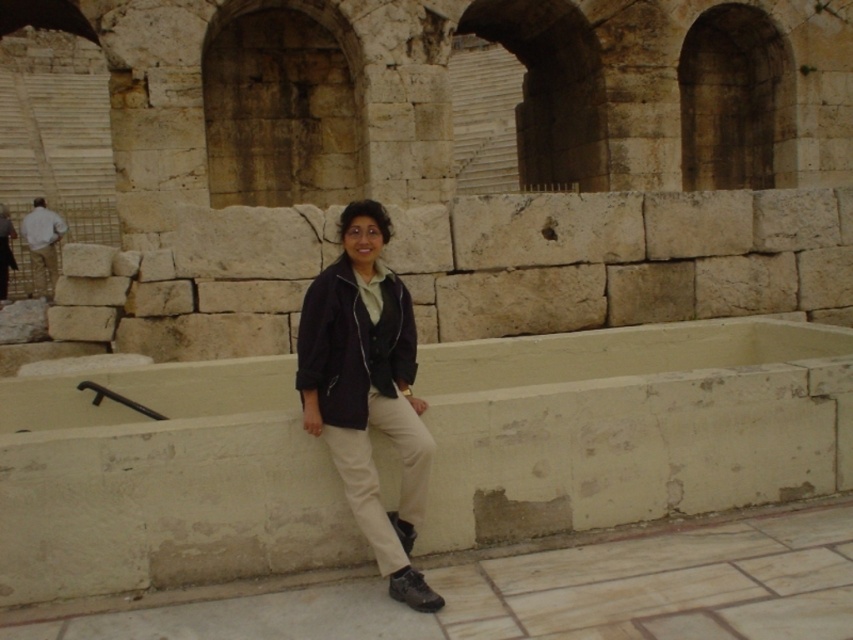
You are standing at point [3,211] and want to walk to the ancient stone structure in the background. Is the point [61,220] on your path?

Yes, the point [61,220] is on your path to the ancient stone structure because it is behind point [3,211], which means it lies along the path towards the structure.

You are a fashion designer observing two jackets in a historical site photo. The jackets are the dark blue jacket at center and the matte black jacket at center. Which jacket appears taller?

The dark blue jacket at center appears taller than the matte black jacket at center according to the description.